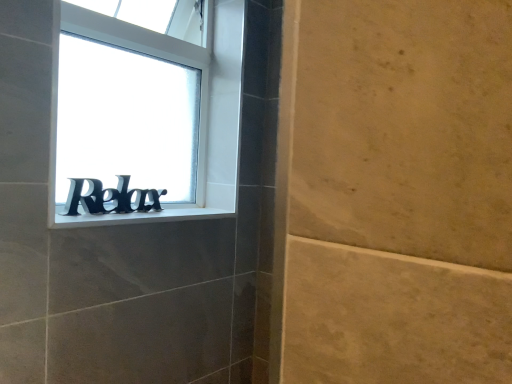
Question: From the image's perspective, would you say white plastic window sill at center is positioned over black metallic letters at center?

Choices:
 (A) no
 (B) yes

Answer: (A)

Question: Can we say white plastic window sill at center lies outside black metallic letters at center?

Choices:
 (A) yes
 (B) no

Answer: (A)

Question: Can you confirm if white plastic window sill at center is smaller than black metallic letters at center?

Choices:
 (A) yes
 (B) no

Answer: (A)

Question: Does white plastic window sill at center lie behind black metallic letters at center?

Choices:
 (A) no
 (B) yes

Answer: (A)

Question: Would you consider white plastic window sill at center to be distant from black metallic letters at center?

Choices:
 (A) yes
 (B) no

Answer: (B)

Question: In terms of width, does white plastic window sill at center look wider or thinner when compared to black plastic sign at lower left?

Choices:
 (A) thin
 (B) wide

Answer: (B)

Question: Would you say white plastic window sill at center is inside or outside black plastic sign at lower left?

Choices:
 (A) inside
 (B) outside

Answer: (B)

Question: Based on their positions, is white plastic window sill at center located to the left or right of black plastic sign at lower left?

Choices:
 (A) right
 (B) left

Answer: (A)

Question: From the image's perspective, is white plastic window sill at center located above or below black plastic sign at lower left?

Choices:
 (A) below
 (B) above

Answer: (A)

Question: Is black plastic sign at lower left inside the boundaries of black metallic letters at center, or outside?

Choices:
 (A) outside
 (B) inside

Answer: (A)

Question: Considering the positions of black plastic sign at lower left and black metallic letters at center in the image, is black plastic sign at lower left taller or shorter than black metallic letters at center?

Choices:
 (A) tall
 (B) short

Answer: (A)

Question: Is point (225, 190) closer or farther from the camera than point (161, 195)?

Choices:
 (A) closer
 (B) farther

Answer: (B)

Question: Is black plastic sign at lower left bigger or smaller than black metallic letters at center?

Choices:
 (A) big
 (B) small

Answer: (A)

Question: Is white plastic window sill at center wider or thinner than black metallic letters at center?

Choices:
 (A) thin
 (B) wide

Answer: (B)

Question: From the image's perspective, is white plastic window sill at center located above or below black metallic letters at center?

Choices:
 (A) above
 (B) below

Answer: (B)